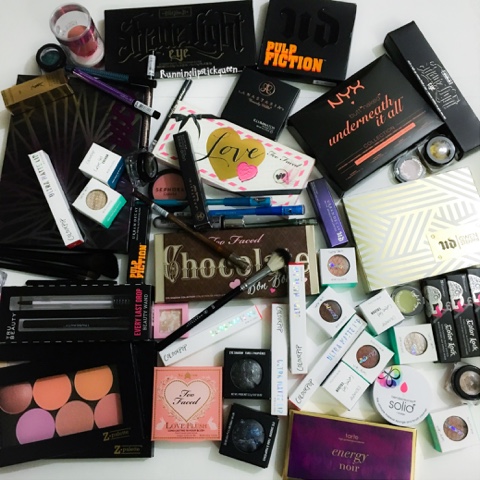
The width and height of the screenshot is (480, 480). What are the coordinates of `box` in the screenshot? It's located at (179, 408).